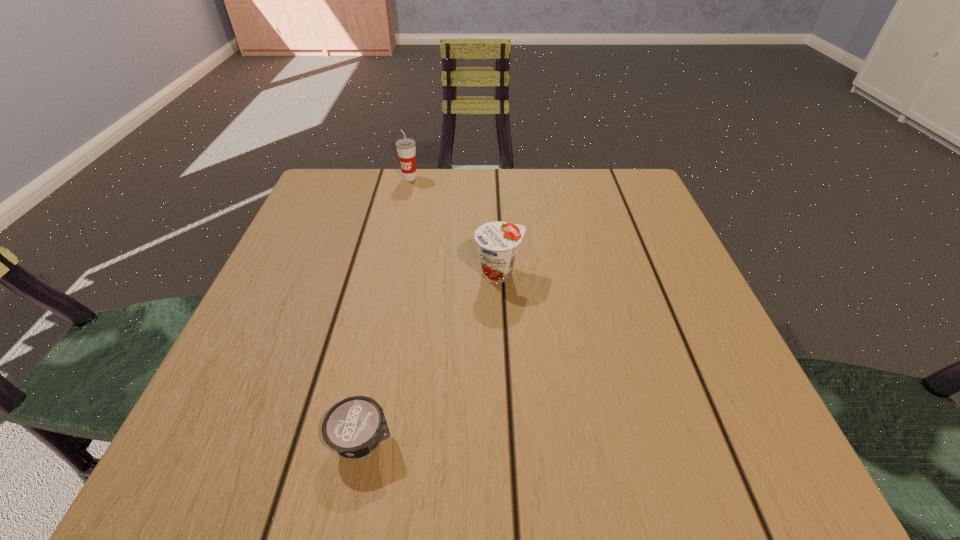
Where is `vacant area that lies between the second tallest object and the left yogurt`? The width and height of the screenshot is (960, 540). vacant area that lies between the second tallest object and the left yogurt is located at coordinates (431, 356).

Locate an element on the screen. Image resolution: width=960 pixels, height=540 pixels. free spot between the second farthest object and the shortest object is located at coordinates (431, 356).

Identify the location of vacant area between the left yogurt and the cup. (387, 309).

Locate an element on the screen. The image size is (960, 540). unoccupied position between the rightmost object and the farthest object is located at coordinates (454, 225).

Identify the location of empty location between the rightmost object and the farthest object. The width and height of the screenshot is (960, 540). (454, 225).

This screenshot has width=960, height=540. I want to click on free spot between the nearest object and the cup, so click(x=387, y=309).

This screenshot has height=540, width=960. What are the coordinates of `free space between the farthest object and the rightmost object` in the screenshot? It's located at tap(454, 225).

Where is `unoccupied position between the rightmost object and the tallest object`? Image resolution: width=960 pixels, height=540 pixels. unoccupied position between the rightmost object and the tallest object is located at coordinates (454, 225).

At what (x,y) coordinates should I click in order to perform the action: click on object that is the second closest to the nearer yogurt. Please return your answer as a coordinate pair (x, y). The image size is (960, 540). Looking at the image, I should click on (406, 149).

Identify which object is the nearest to the second shortest object. Please provide its 2D coordinates. Your answer should be formatted as a tuple, i.e. [(x, y)], where the tuple contains the x and y coordinates of a point satisfying the conditions above.

[(353, 427)]